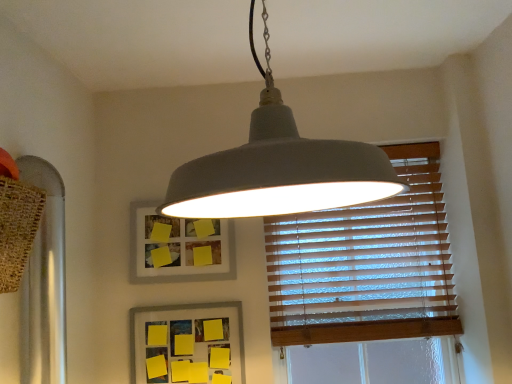
Question: In the image, is matte gray lampshade at center positioned in front of or behind matte gray picture frame at upper center, which is the first picture frame in top-to-bottom order?

Choices:
 (A) behind
 (B) front

Answer: (B)

Question: Is point (228, 190) positioned closer to the camera than point (156, 246)?

Choices:
 (A) farther
 (B) closer

Answer: (B)

Question: Based on their relative distances, which object is nearer to the matte gray picture frame at upper center, which is the second picture frame in bottom-to-top order?

Choices:
 (A) wooden blinds at upper right
 (B) yellow paper at lower center, the 2th picture frame positioned from the top
 (C) matte gray lampshade at center

Answer: (B)

Question: Based on their relative distances, which object is farther from the matte gray lampshade at center?

Choices:
 (A) wooden blinds at upper right
 (B) yellow paper at lower center, the 2th picture frame positioned from the top
 (C) matte gray picture frame at upper center, which is the second picture frame in bottom-to-top order

Answer: (B)